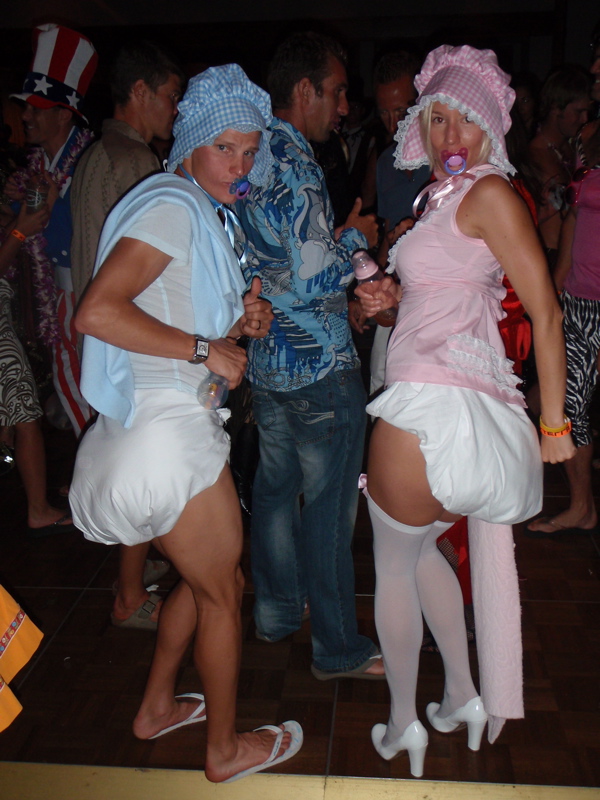
What are the coordinates of `pacifier` in the screenshot? It's located at (242, 188), (455, 166).